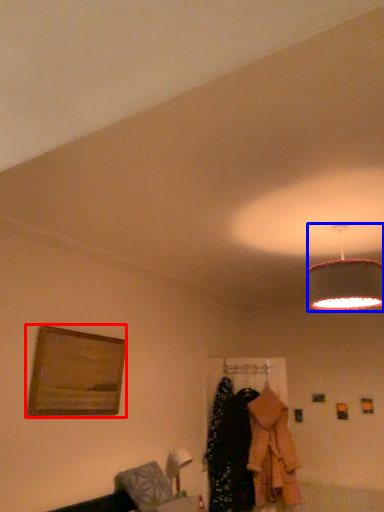
Question: Which of the following is the closest to the observer, picture frame (highlighted by a red box) or lamp (highlighted by a blue box)?

Choices:
 (A) picture frame
 (B) lamp

Answer: (B)